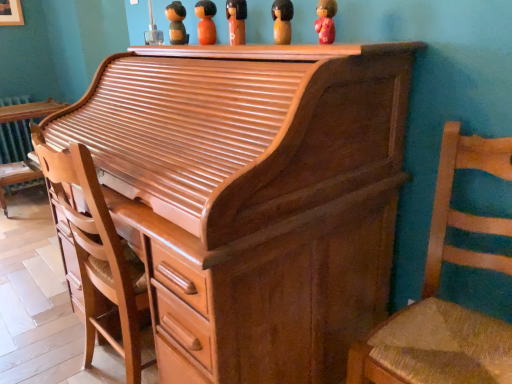
The image size is (512, 384). I want to click on free spot to the left of matte pink figurine at upper center, the 5th toy in the back-to-front sequence, so click(275, 51).